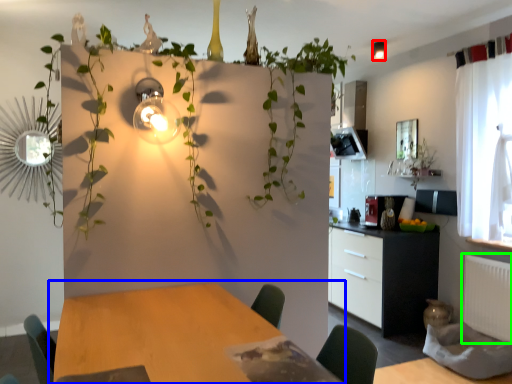
Question: Based on their relative distances, which object is farther from light fixture (highlighted by a red box)? Choose from table (highlighted by a blue box) and radiator (highlighted by a green box).

Choices:
 (A) table
 (B) radiator

Answer: (A)